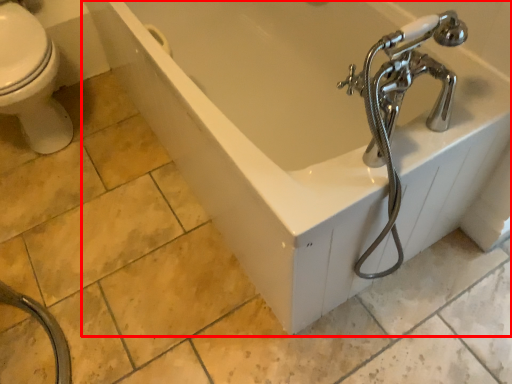
Question: In this image, where is bathtub (annotated by the red box) located relative to garden hose?

Choices:
 (A) left
 (B) right

Answer: (B)